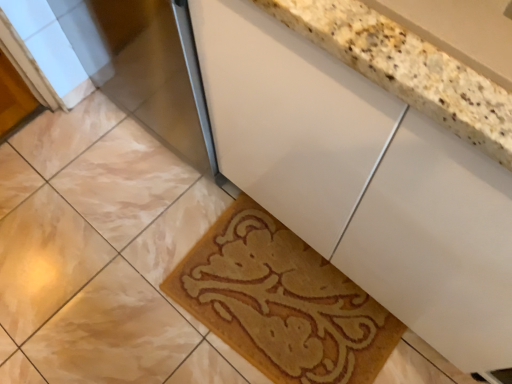
You are a GUI agent. You are given a task and a screenshot of the screen. Output one action in this format:
    pyautogui.click(x=<x>, y=<y>)
    Task: Click on the free location to the left of beige textured bath mat at lower center
    The width and height of the screenshot is (512, 384).
    Given the screenshot: What is the action you would take?
    pyautogui.click(x=129, y=287)